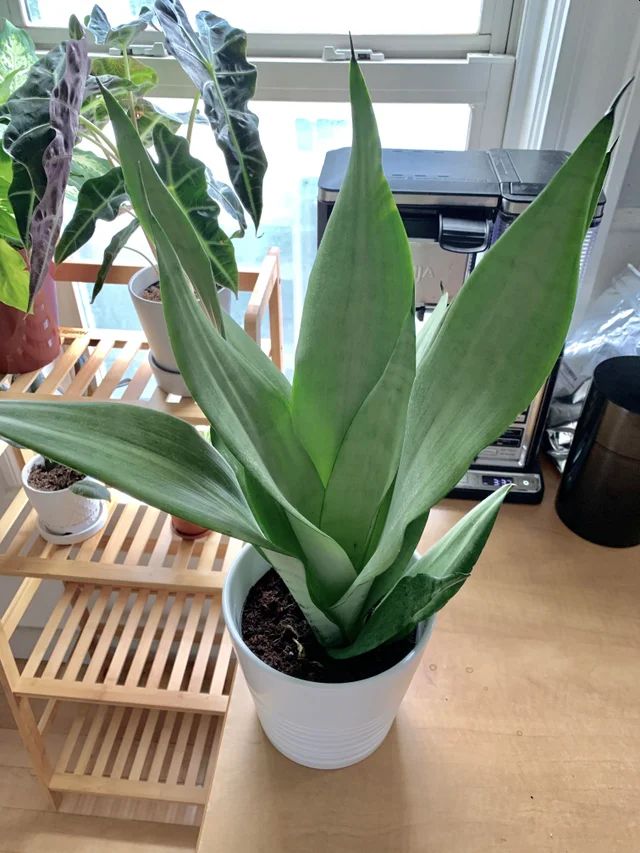
Where is `brown wood floor`? The image size is (640, 853). brown wood floor is located at coordinates (75, 830).